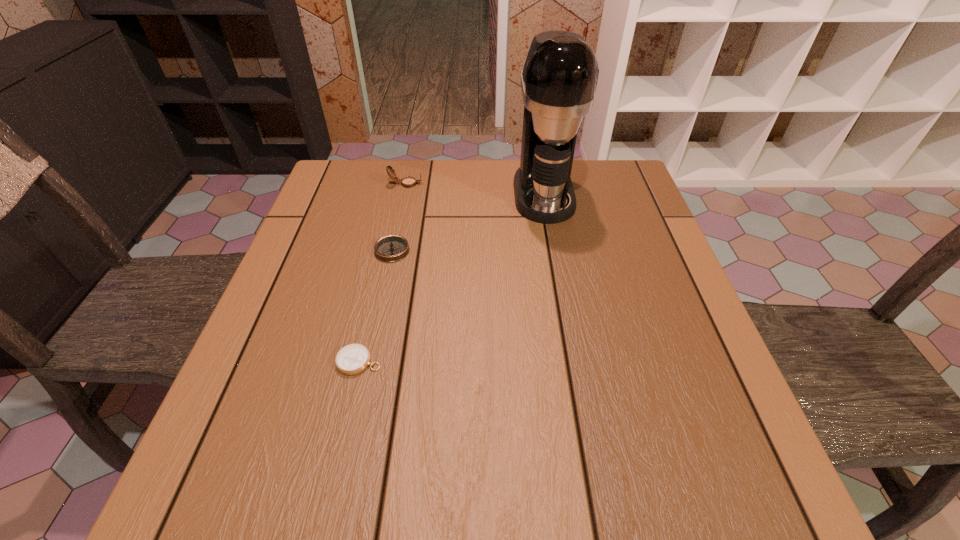
Image resolution: width=960 pixels, height=540 pixels. I want to click on the second closest compass to the nearest compass, so click(x=408, y=182).

What are the coordinates of `vacant space that satisfies the following two spatial constraints: 1. on the face of the farthest compass; 2. on the back side of the second nearest object` in the screenshot? It's located at (392, 251).

Find the location of a particular element. The image size is (960, 540). free space that satisfies the following two spatial constraints: 1. on the face of the tallest compass; 2. on the right side of the third farthest object is located at coordinates (392, 251).